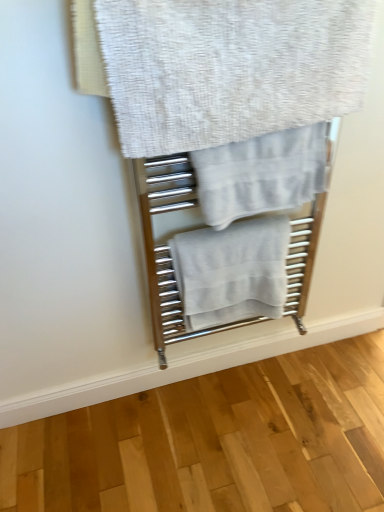
Question: Considering the relative sizes of white textured towel at upper center, marked as the third towel in a bottom-to-top arrangement, and white cotton towel at center, the 3th towel in the top-to-bottom sequence, in the image provided, is white textured towel at upper center, marked as the third towel in a bottom-to-top arrangement, wider than white cotton towel at center, the 3th towel in the top-to-bottom sequence,?

Choices:
 (A) no
 (B) yes

Answer: (A)

Question: Is white textured towel at upper center, acting as the first towel starting from the top, oriented away from white cotton towel at center, which is the 1th towel in bottom-to-top order?

Choices:
 (A) yes
 (B) no

Answer: (B)

Question: Is white textured towel at upper center, marked as the third towel in a bottom-to-top arrangement, to the right of white cotton towel at center, which is the 1th towel in bottom-to-top order, from the viewer's perspective?

Choices:
 (A) no
 (B) yes

Answer: (A)

Question: From the image's perspective, does white textured towel at upper center, acting as the first towel starting from the top, appear lower than white cotton towel at center, which is the 1th towel in bottom-to-top order?

Choices:
 (A) yes
 (B) no

Answer: (B)

Question: Is white textured towel at upper center, acting as the first towel starting from the top, further to the viewer compared to white cotton towel at center, which is the 1th towel in bottom-to-top order?

Choices:
 (A) no
 (B) yes

Answer: (A)

Question: Is light gray cotton towel at center, which is the second towel from bottom to top, wider or thinner than white cotton towel at center, which is the 1th towel in bottom-to-top order?

Choices:
 (A) wide
 (B) thin

Answer: (B)

Question: From the image's perspective, is light gray cotton towel at center, which is the second towel from bottom to top, located above or below white cotton towel at center, the 3th towel in the top-to-bottom sequence?

Choices:
 (A) below
 (B) above

Answer: (B)

Question: From a real-world perspective, is light gray cotton towel at center, which ranks as the second towel in top-to-bottom order, above or below white cotton towel at center, the 3th towel in the top-to-bottom sequence?

Choices:
 (A) above
 (B) below

Answer: (A)

Question: Visually, is light gray cotton towel at center, which is the second towel from bottom to top, positioned to the left or to the right of white cotton towel at center, the 3th towel in the top-to-bottom sequence?

Choices:
 (A) left
 (B) right

Answer: (B)

Question: Is light gray cotton towel at center, which ranks as the second towel in top-to-bottom order, taller or shorter than white textured towel at upper center, acting as the first towel starting from the top?

Choices:
 (A) tall
 (B) short

Answer: (B)

Question: Is point (220, 210) positioned closer to the camera than point (271, 86)?

Choices:
 (A) closer
 (B) farther

Answer: (B)

Question: Looking at the image, does light gray cotton towel at center, which is the second towel from bottom to top, seem bigger or smaller compared to white textured towel at upper center, acting as the first towel starting from the top?

Choices:
 (A) big
 (B) small

Answer: (B)

Question: Looking at their shapes, would you say light gray cotton towel at center, which is the second towel from bottom to top, is wider or thinner than white textured towel at upper center, acting as the first towel starting from the top?

Choices:
 (A) thin
 (B) wide

Answer: (B)

Question: From a real-world perspective, is white cotton towel at center, the 3th towel in the top-to-bottom sequence, above or below white textured towel at upper center, marked as the third towel in a bottom-to-top arrangement?

Choices:
 (A) below
 (B) above

Answer: (A)

Question: Do you think white cotton towel at center, the 3th towel in the top-to-bottom sequence, is within white textured towel at upper center, acting as the first towel starting from the top, or outside of it?

Choices:
 (A) outside
 (B) inside

Answer: (A)